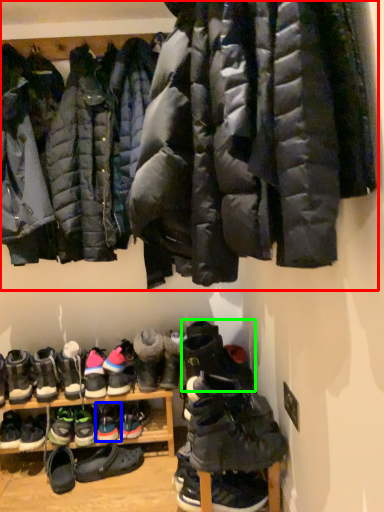
Question: Considering the real-world distances, which object is farthest from jacket (highlighted by a red box)? footwear (highlighted by a blue box) or footwear (highlighted by a green box)?

Choices:
 (A) footwear
 (B) footwear

Answer: (A)